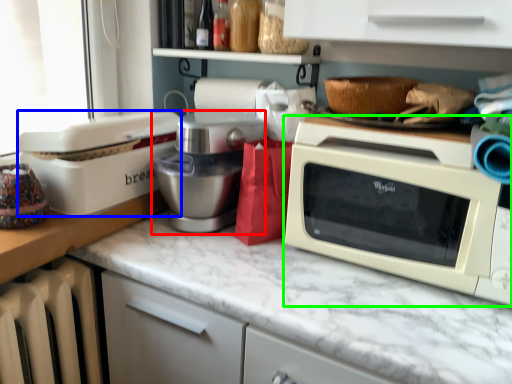
Question: Which object is positioned farthest from mixer (highlighted by a red box)? Select from appliance (highlighted by a blue box) and microwave oven (highlighted by a green box).

Choices:
 (A) appliance
 (B) microwave oven

Answer: (B)